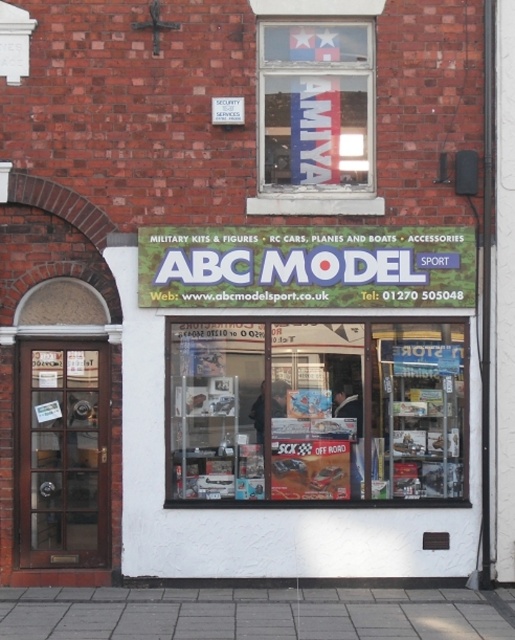
You are a delivery person who needs to place a large box on the ground near the entrance of ABC Model Sport. The box is 2 meters tall. If you stand at the gray concrete pavement at lower center, can you safely place the box without it hitting the white plastic sign at center?

The white plastic sign at center is 2.29 meters from the gray concrete pavement at lower center. Since the box is only 2 meters tall, there is enough clearance between the box and the sign. Therefore, you can safely place the box without it hitting the white plastic sign at center.

What is the position of the matte plastic model kit at center relative to the white plastic sign at center in the ABC Model Sport storefront?

The matte plastic model kit at center is located below the white plastic sign at center.

You are a delivery person trying to park your 2.5 meter wide truck in front of the ABC Model Sport store. The truck needs to be positioned so that it doesn t block the white plastic sign at center. Considering the space between the sign and the gray concrete pavement at lower center, can the truck fit without overlapping either object?

The white plastic sign at center is thinner than the gray concrete pavement at lower center. Since the truck is 2.5 meters wide, it depends on the combined width of both objects. However, since the sign is thinner, there might be enough space if the truck is positioned between them. But without exact measurements, it is uncertain. Please check the actual dimensions before deciding.